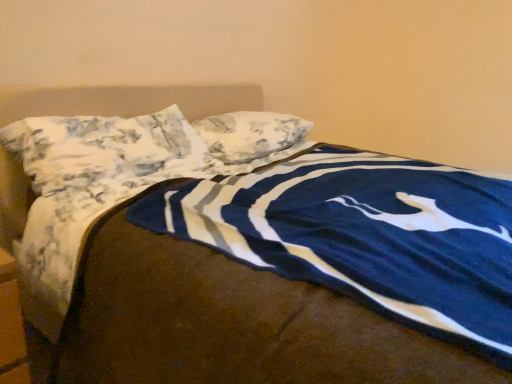
Question: Can you confirm if floral fabric pillow at upper center, which is the first pillow in front-to-back order, is positioned to the left of floral fabric pillow at center, arranged as the 2th pillow when viewed from the front?

Choices:
 (A) yes
 (B) no

Answer: (A)

Question: Is floral fabric pillow at upper center, which is the first pillow in front-to-back order, not close to floral fabric pillow at center, arranged as the 2th pillow when viewed from the front?

Choices:
 (A) no
 (B) yes

Answer: (A)

Question: Does floral fabric pillow at upper center, the second pillow viewed from the back, come behind floral fabric pillow at center, the 1th pillow in the back-to-front sequence?

Choices:
 (A) no
 (B) yes

Answer: (A)

Question: Considering the relative sizes of floral fabric pillow at upper center, which is the first pillow in front-to-back order, and floral fabric pillow at center, the 1th pillow in the back-to-front sequence, in the image provided, is floral fabric pillow at upper center, which is the first pillow in front-to-back order, wider than floral fabric pillow at center, the 1th pillow in the back-to-front sequence,?

Choices:
 (A) yes
 (B) no

Answer: (A)

Question: From the image's perspective, is floral fabric pillow at upper center, which is the first pillow in front-to-back order, beneath floral fabric pillow at center, the 1th pillow in the back-to-front sequence?

Choices:
 (A) yes
 (B) no

Answer: (A)

Question: Is floral fabric pillow at upper center, which is the first pillow in front-to-back order, oriented away from floral fabric pillow at center, arranged as the 2th pillow when viewed from the front?

Choices:
 (A) no
 (B) yes

Answer: (A)

Question: Does floral fabric pillow at center, arranged as the 2th pillow when viewed from the front, appear on the left side of floral fabric pillow at upper center, the second pillow viewed from the back?

Choices:
 (A) yes
 (B) no

Answer: (B)

Question: Is floral fabric pillow at center, arranged as the 2th pillow when viewed from the front, to the right of floral fabric pillow at upper center, the second pillow viewed from the back, from the viewer's perspective?

Choices:
 (A) yes
 (B) no

Answer: (A)

Question: Considering the relative sizes of floral fabric pillow at center, arranged as the 2th pillow when viewed from the front, and floral fabric pillow at upper center, the second pillow viewed from the back, in the image provided, is floral fabric pillow at center, arranged as the 2th pillow when viewed from the front, wider than floral fabric pillow at upper center, the second pillow viewed from the back,?

Choices:
 (A) yes
 (B) no

Answer: (B)

Question: From the image's perspective, does floral fabric pillow at center, the 1th pillow in the back-to-front sequence, appear lower than floral fabric pillow at upper center, the second pillow viewed from the back?

Choices:
 (A) yes
 (B) no

Answer: (B)

Question: Is floral fabric pillow at center, the 1th pillow in the back-to-front sequence, with floral fabric pillow at upper center, the second pillow viewed from the back?

Choices:
 (A) no
 (B) yes

Answer: (A)

Question: Is floral fabric pillow at center, the 1th pillow in the back-to-front sequence, oriented away from floral fabric pillow at upper center, the second pillow viewed from the back?

Choices:
 (A) yes
 (B) no

Answer: (B)

Question: Is floral fabric pillow at center, arranged as the 2th pillow when viewed from the front, inside or outside of floral fabric pillow at upper center, the second pillow viewed from the back?

Choices:
 (A) outside
 (B) inside

Answer: (A)